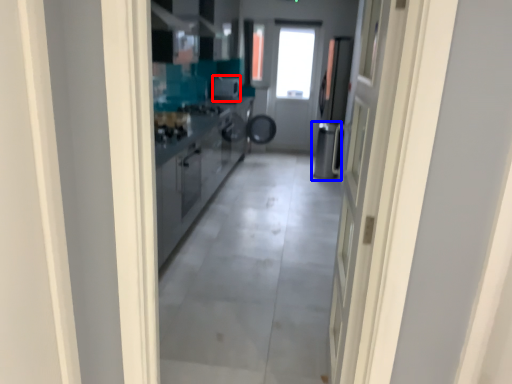
Question: Which object is further to the camera taking this photo, appliance (highlighted by a red box) or dish washer (highlighted by a blue box)?

Choices:
 (A) appliance
 (B) dish washer

Answer: (A)